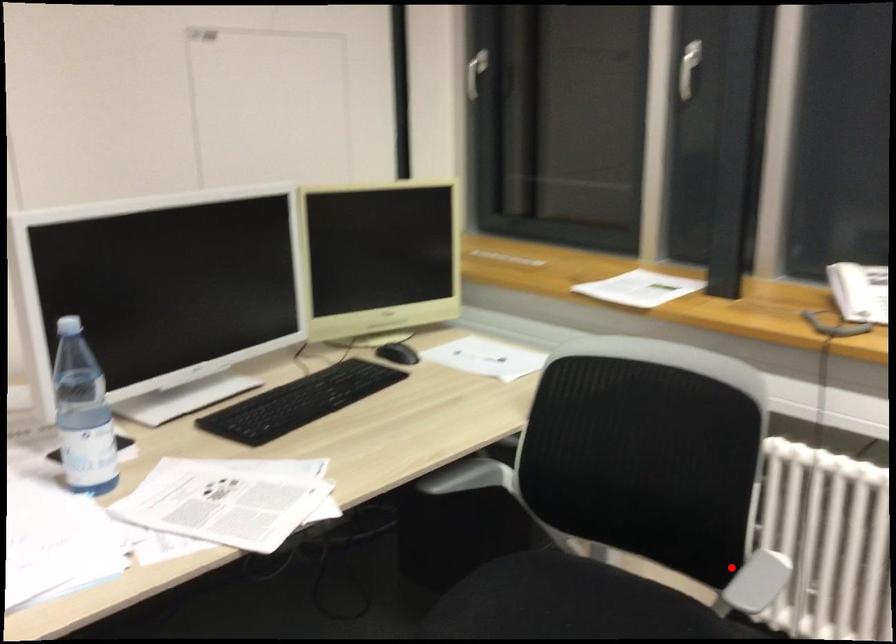
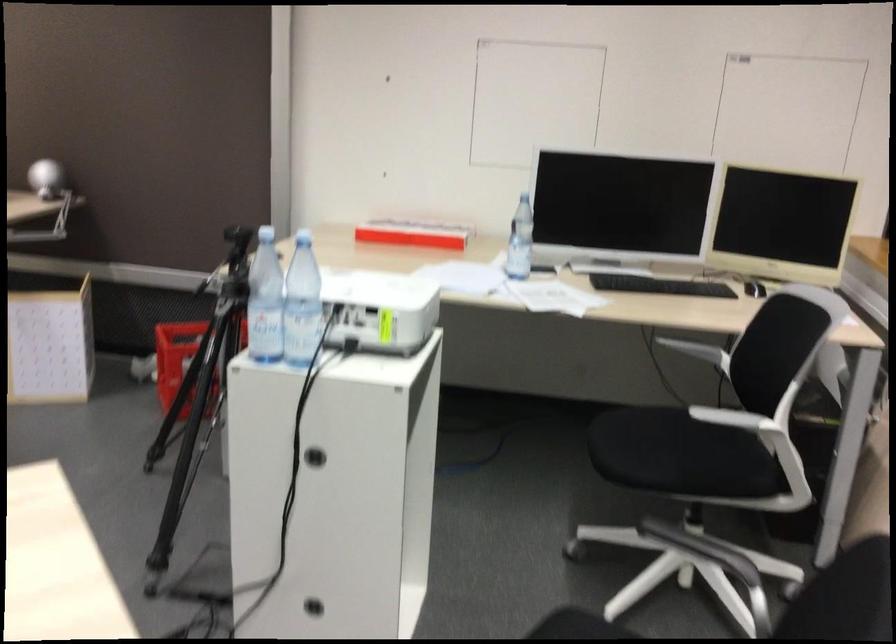
Question: I am providing you with two images of the same scene from different viewpoints. A red point is marked on the first image. Can you still see the location of the red point in image 2?

Choices:
 (A) Yes
 (B) No

Answer: (A)